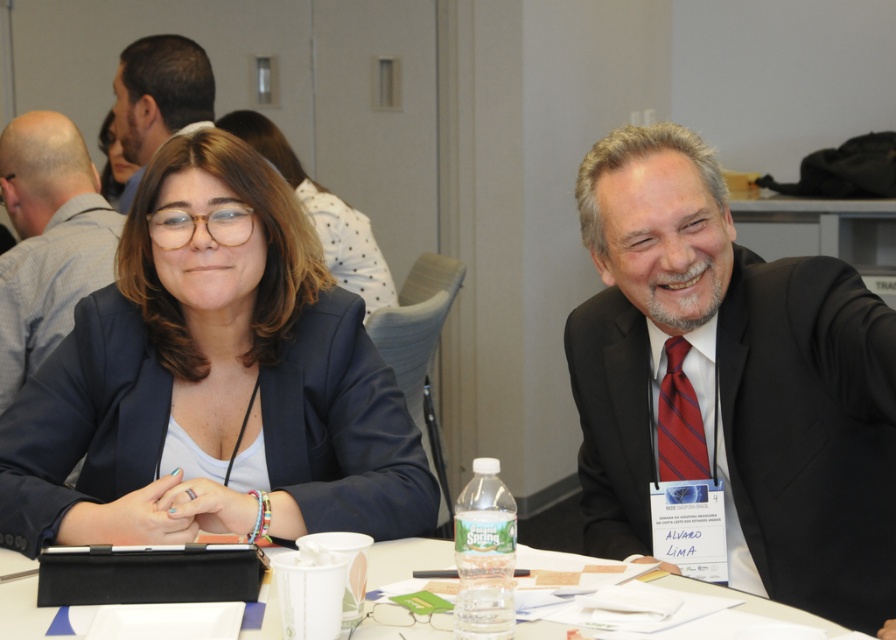
In the conference room scene, there are two people sitting at a table. You notice the matte black suit at center and the matte black glasses at center. From the perspective of someone sitting across the table, which object is positioned to the left?

The matte black suit at center is to the left of the matte black glasses at center, so from the perspective of someone sitting across the table, the matte black suit at center would be on the left side.

You are standing in the conference room and need to locate the dark suit at right. Based on the coordinates provided, can you determine its position relative to the center of the room?

The dark suit at right is located at coordinates 0.608 on the x and 0.816 on the y axis. Since the center of the room would be at 0.5 on both axes, the dark suit at right is positioned to the right and above the center of the room.

You are an event planner organizing a photoshoot in this conference room. You need to ensure that the matte black suit at center and the matte black glasses at center are visible in the frame. Given that the camera has a limited zoom range, which object should you prioritize keeping closer to the camera to ensure both are visible?

The matte black suit at center is smaller than the matte black glasses at center. To ensure both are visible, prioritize keeping the matte black suit at center closer to the camera since it is smaller and might be harder to see from a distance.